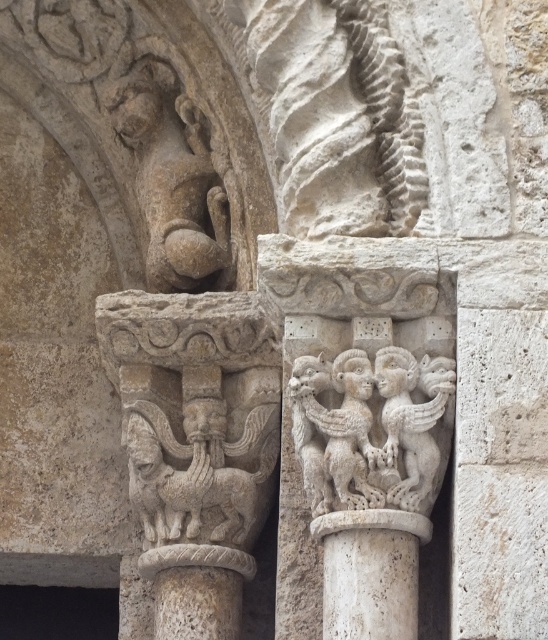
Question: Which object is the closest to the white stone sculpture at center?

Choices:
 (A) carved stone gargoyle at upper left
 (B) carved stone lion at center
 (C) white stone column at center

Answer: (C)

Question: Estimate the real-world distances between objects in this image. Which object is closer to the carved stone lion at center?

Choices:
 (A) carved stone gargoyle at upper left
 (B) white stone column at center

Answer: (A)

Question: Which of the following is the farthest from the observer?

Choices:
 (A) (379, 627)
 (B) (255, 428)
 (C) (178, 208)
 (D) (313, 484)

Answer: (C)

Question: Does white stone sculpture at center appear on the right side of carved stone lion at center?

Choices:
 (A) yes
 (B) no

Answer: (A)

Question: In this image, where is white stone sculpture at center located relative to white stone column at center?

Choices:
 (A) right
 (B) left

Answer: (B)

Question: Can you confirm if white stone sculpture at center is positioned above white stone column at center?

Choices:
 (A) no
 (B) yes

Answer: (B)